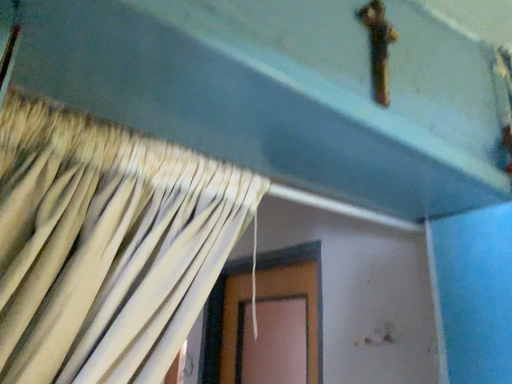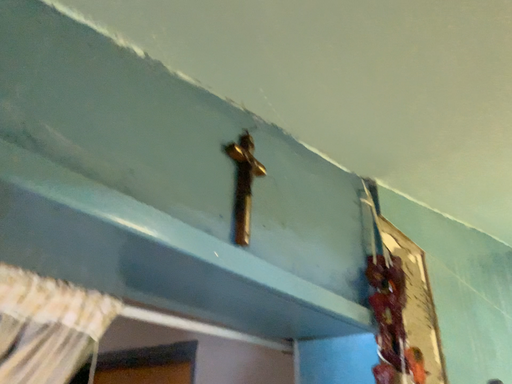
Question: How did the camera likely rotate when shooting the video?

Choices:
 (A) rotated upward
 (B) rotated downward

Answer: (A)